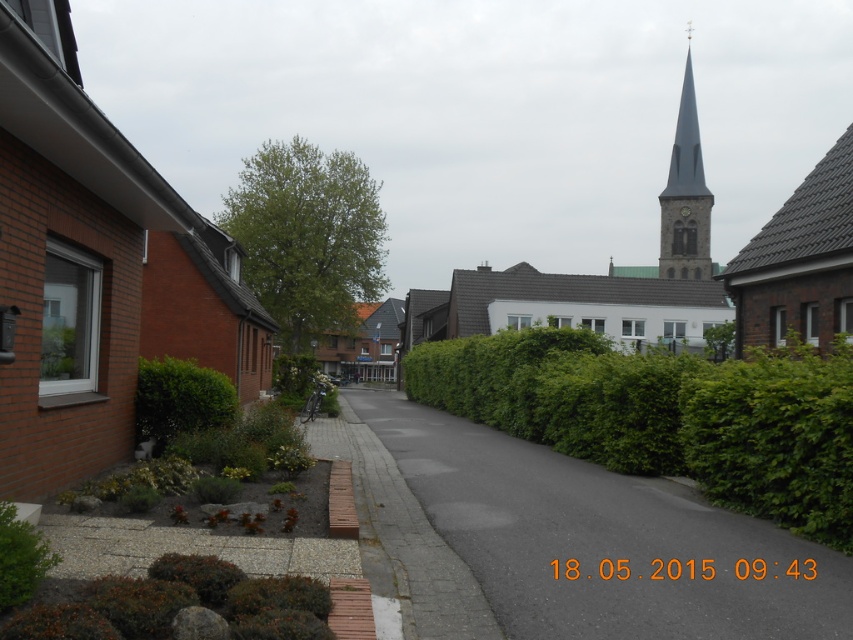
Question: Does brick church at left appear under asphalt at center?

Choices:
 (A) yes
 (B) no

Answer: (B)

Question: Which object appears closest to the camera in this image?

Choices:
 (A) gray stone steeple at upper center
 (B) gray stone church steeple at center
 (C) brown tiled roof at upper right

Answer: (C)

Question: Which of these objects is positioned farthest from the brick church at left?

Choices:
 (A) gray stone steeple at upper center
 (B) asphalt at center

Answer: (A)

Question: Does asphalt at center have a larger size compared to gray stone church steeple at center?

Choices:
 (A) no
 (B) yes

Answer: (A)

Question: Among these objects, which one is farthest from the camera?

Choices:
 (A) brick church at left
 (B) green leafy bush at lower left

Answer: (A)

Question: Can you confirm if brick church at left is positioned to the right of green leafy hedge at lower left?

Choices:
 (A) yes
 (B) no

Answer: (B)